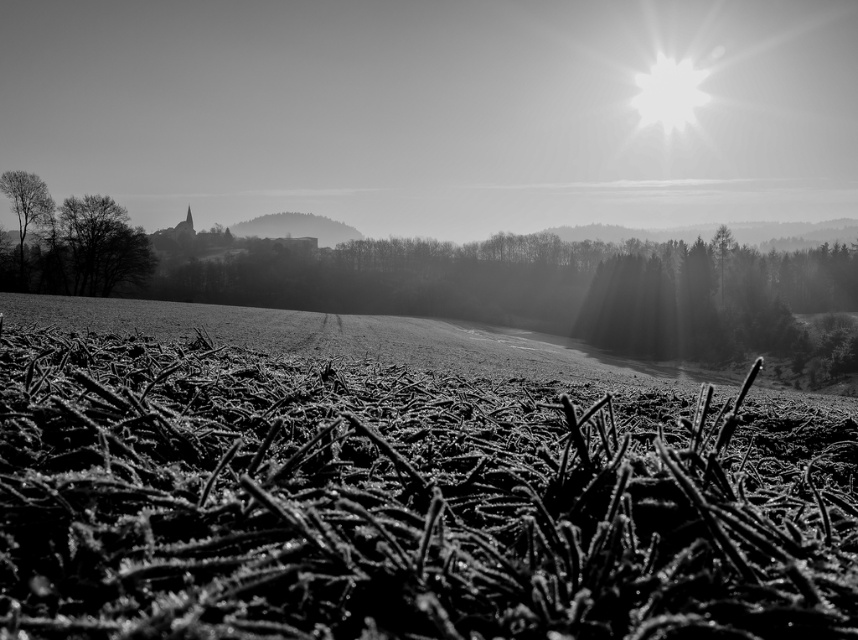
You are an artist sketching the scene and want to draw the dark textured tree at left and smooth bark tree at left. Which one should you draw first if you start from the left side of the paper?

You should draw the smooth bark tree at left first because it is positioned to the left of the dark textured tree at left.

You are a photographer trying to capture the frosty scene. You have a camera with a wide angle lens that can capture large objects. Which object between the frosted grass at center and the smooth bark tree at left would be better suited for your lens?

The frosted grass at center is larger in size than the smooth bark tree at left, so it would be better suited for the wide angle lens as it can capture large objects effectively.